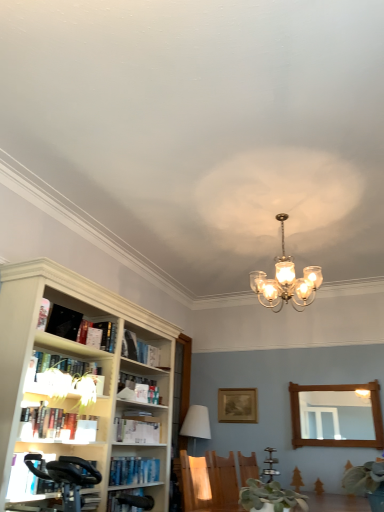
Question: From the image's perspective, is black matte bookshelf at upper left, the ninth book in the bottom-to-top sequence, on hardcover book at left, arranged as the 4th book when viewed from the top?

Choices:
 (A) no
 (B) yes

Answer: (B)

Question: Are black matte bookshelf at upper left, acting as the second book starting from the top, and hardcover book at left, arranged as the 4th book when viewed from the top, beside each other?

Choices:
 (A) yes
 (B) no

Answer: (B)

Question: Does black matte bookshelf at upper left, the ninth book in the bottom-to-top sequence, lie in front of hardcover book at left, arranged as the 4th book when viewed from the top?

Choices:
 (A) yes
 (B) no

Answer: (A)

Question: Considering the relative sizes of black matte bookshelf at upper left, the ninth book in the bottom-to-top sequence, and hardcover book at left, arranged as the 4th book when viewed from the top, in the image provided, is black matte bookshelf at upper left, the ninth book in the bottom-to-top sequence, smaller than hardcover book at left, arranged as the 4th book when viewed from the top,?

Choices:
 (A) no
 (B) yes

Answer: (A)

Question: From the image's perspective, is black matte bookshelf at upper left, acting as the second book starting from the top, under hardcover book at left, arranged as the 4th book when viewed from the top?

Choices:
 (A) yes
 (B) no

Answer: (B)

Question: Considering the positions of white matte bookshelf at upper left, the first book from the top, and white fabric lampshade at center, which is the first lamp in back-to-front order, in the image, is white matte bookshelf at upper left, the first book from the top, taller or shorter than white fabric lampshade at center, which is the first lamp in back-to-front order,?

Choices:
 (A) tall
 (B) short

Answer: (B)

Question: In terms of size, does white matte bookshelf at upper left, the first book from the top, appear bigger or smaller than white fabric lampshade at center, which ranks as the second lamp in right-to-left order?

Choices:
 (A) small
 (B) big

Answer: (A)

Question: Is white matte bookshelf at upper left, the first book from the top, wider or thinner than white fabric lampshade at center, which is the first lamp in back-to-front order?

Choices:
 (A) wide
 (B) thin

Answer: (B)

Question: From a real-world perspective, is white matte bookshelf at upper left, the first book from the top, positioned above or below white fabric lampshade at center, which is the 2th lamp from front to back?

Choices:
 (A) below
 (B) above

Answer: (B)

Question: From a real-world perspective, is wooden mirror at right above or below hardcover book at lower left, positioned as the 2th book in bottom-to-top order?

Choices:
 (A) above
 (B) below

Answer: (A)

Question: From their relative heights in the image, would you say wooden mirror at right is taller or shorter than hardcover book at lower left, the 9th book from the top?

Choices:
 (A) tall
 (B) short

Answer: (A)

Question: From the image's perspective, is wooden mirror at right positioned above or below hardcover book at lower left, the 9th book from the top?

Choices:
 (A) above
 (B) below

Answer: (A)

Question: Visually, is wooden mirror at right positioned to the left or to the right of hardcover book at lower left, the 9th book from the top?

Choices:
 (A) left
 (B) right

Answer: (B)

Question: Considering the relative positions of hardcover book at lower left, positioned as the 2th book in bottom-to-top order, and white paper book at left, placed as the fifth book when sorted from top to bottom, in the image provided, is hardcover book at lower left, positioned as the 2th book in bottom-to-top order, to the left or to the right of white paper book at left, placed as the fifth book when sorted from top to bottom,?

Choices:
 (A) right
 (B) left

Answer: (A)

Question: Is point (91, 509) positioned closer to the camera than point (46, 356)?

Choices:
 (A) farther
 (B) closer

Answer: (B)